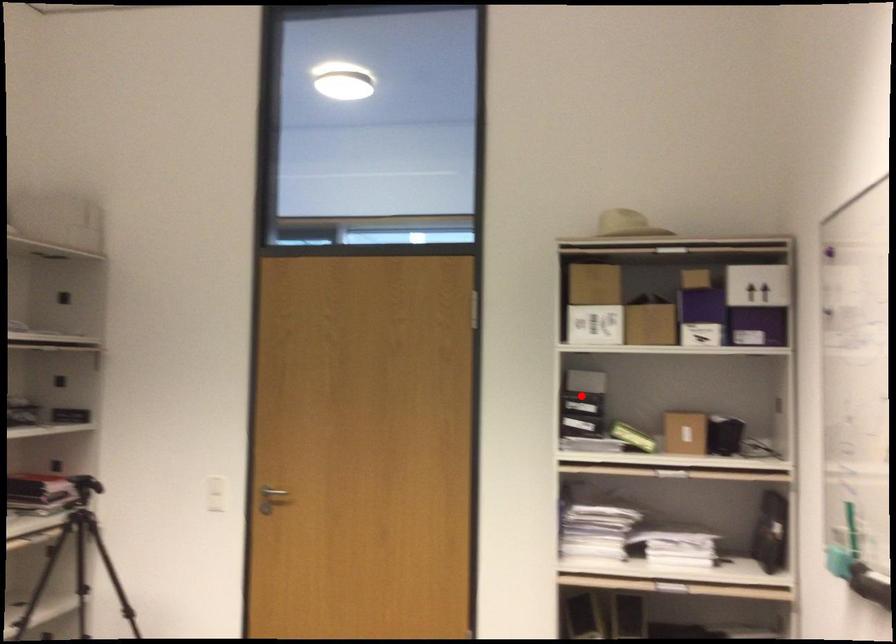
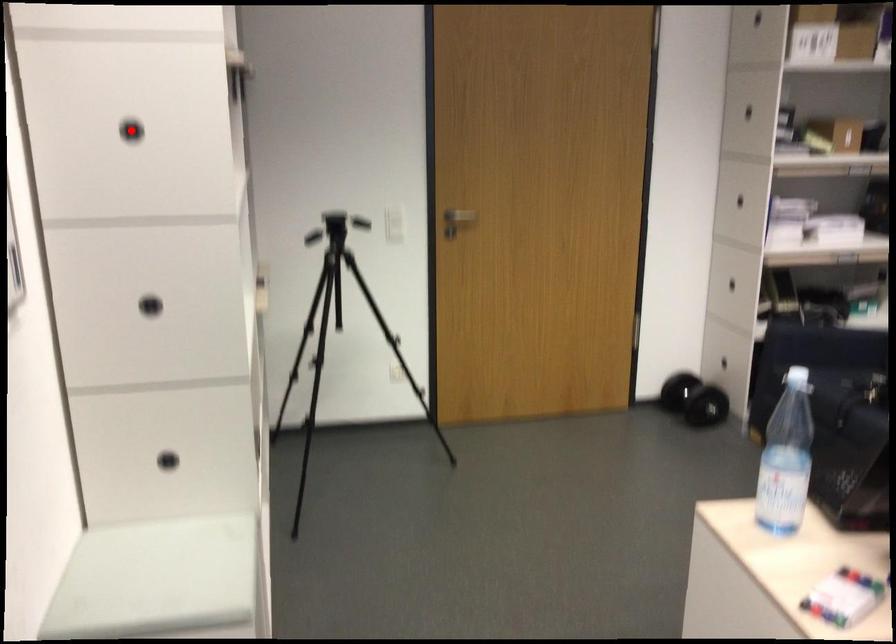
I am providing you with two images of the same scene from different viewpoints. A red point is marked on the first image and another point is marked on the second image. Is the marked point in image1 the same physical position as the marked point in image2?

No